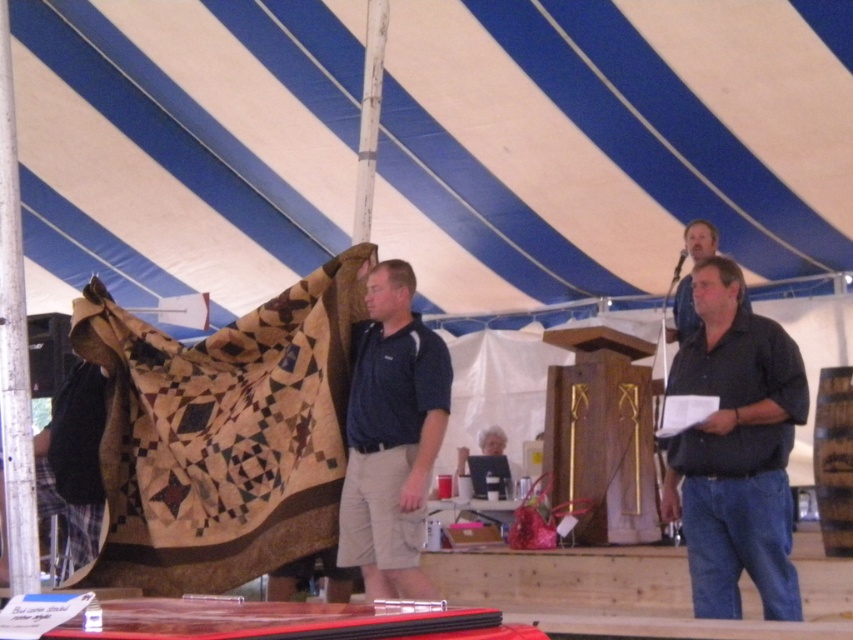
You are an event organizer trying to decide which dark blue shirt to wear for the fair. You have both the dark blue shirt at center and the dark blue cotton polo shirt at center. Based on the image, which one is wider?

The dark blue shirt at center is wider than the dark blue cotton polo shirt at center according to the description.

You are organizing a clothing display and need to determine which item takes up more space. Based on the scene, which object is larger in size between the dark blue cotton polo shirt at center and the dark brown leather jacket at upper right?

The dark blue cotton polo shirt at center is larger in size compared to the dark brown leather jacket at upper right.